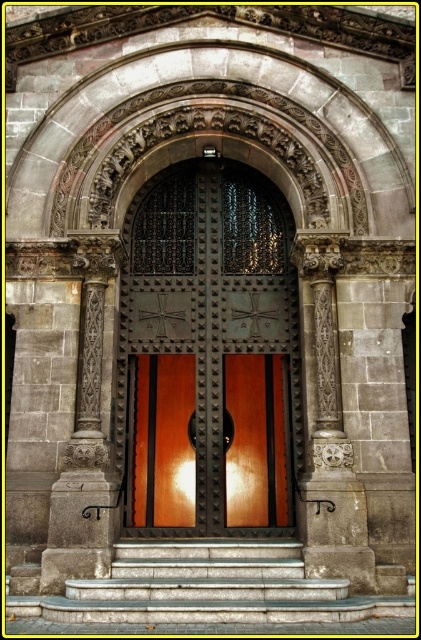
You are an architect planning to install a new lighting fixture above the polished wood door at center and the smooth stone steps at center. Based on their sizes, which object should the brighter light be directed towards?

The polished wood door at center has a larger size compared to the smooth stone steps at center, so the brighter light should be directed towards the polished wood door at center to ensure proper illumination.

You are standing at the entrance of the cathedral and want to know the spatial relationship between the two carved stone columns. Is the carved stone column at center located above or below the carved stone column at left?

The carved stone column at center is above the carved stone column at left.